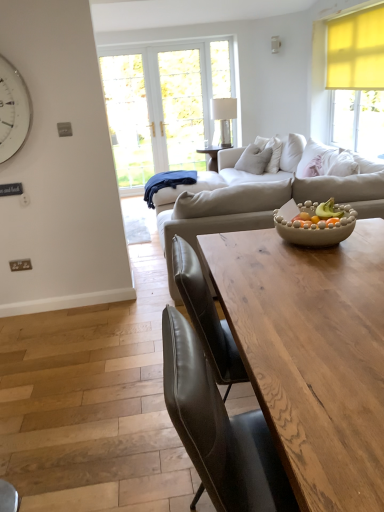
Question: In terms of width, does beige textured bowl at center look wider or thinner when compared to clear glass lamp at center?

Choices:
 (A) wide
 (B) thin

Answer: (A)

Question: Visually, is beige textured bowl at center positioned to the left or to the right of clear glass lamp at center?

Choices:
 (A) right
 (B) left

Answer: (A)

Question: Estimate the real-world distances between objects in this image. Which object is closer to the beige fabric couch at center?

Choices:
 (A) white metallic clock at upper left
 (B) clear glass lamp at center
 (C) wooden table at center
 (D) beige textured bowl at center
 (E) light beige fabric pillow at center

Answer: (D)

Question: Which object is the closest to the beige fabric couch at center?

Choices:
 (A) wooden table at center
 (B) white metallic clock at upper left
 (C) light beige fabric pillow at center
 (D) clear glass lamp at center
 (E) beige textured bowl at center

Answer: (E)